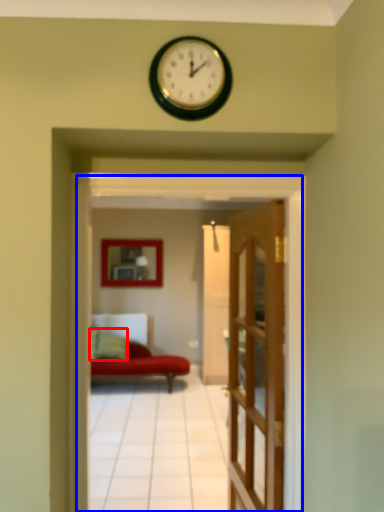
Question: Among these objects, which one is nearest to the camera, pillow (highlighted by a red box) or residence (highlighted by a blue box)?

Choices:
 (A) pillow
 (B) residence

Answer: (B)